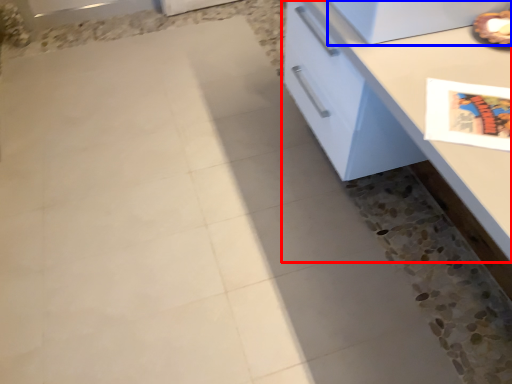
Question: Which point is closer to the camera, countertop (highlighted by a red box) or appliance (highlighted by a blue box)?

Choices:
 (A) countertop
 (B) appliance

Answer: (A)